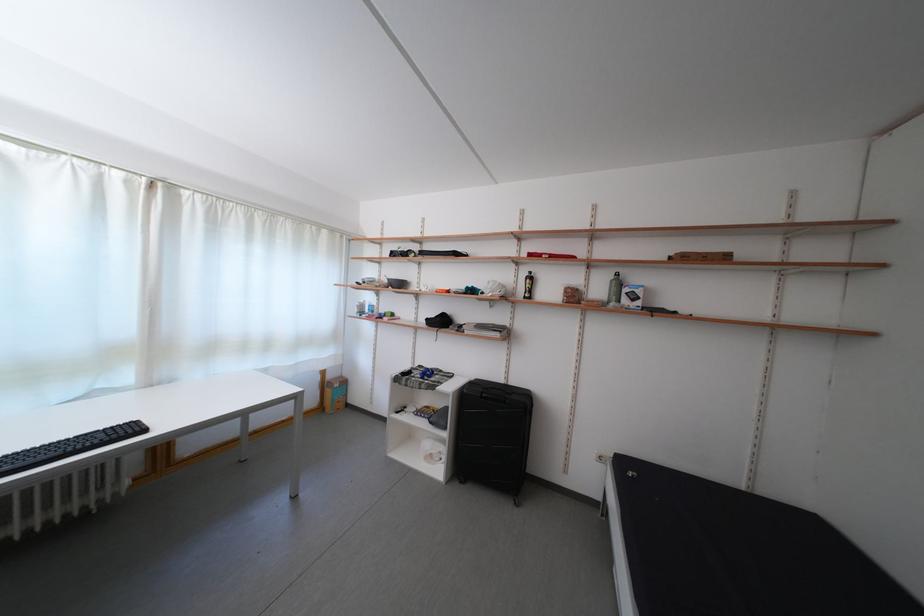
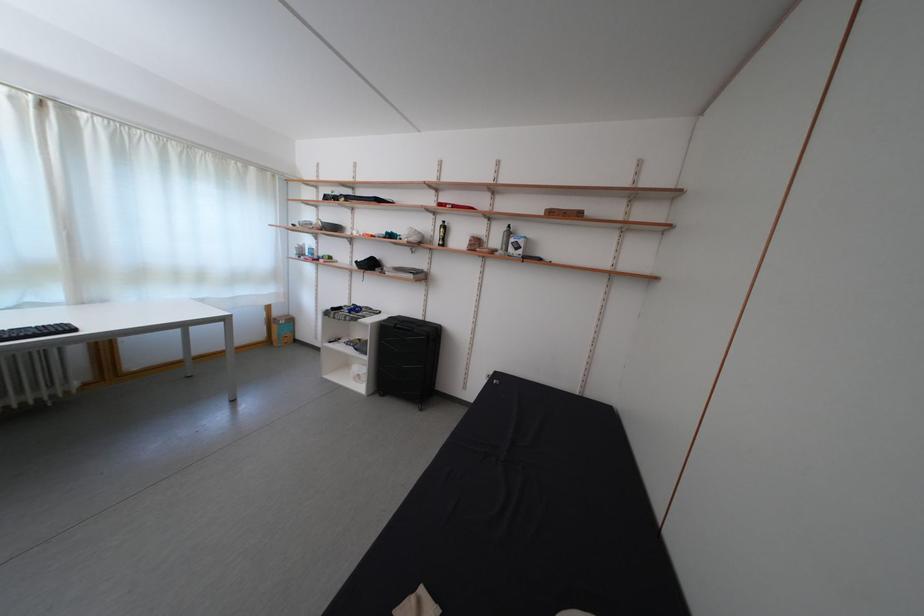
In the second image, find the point that corresponds to (x=338, y=382) in the first image.

(285, 320)